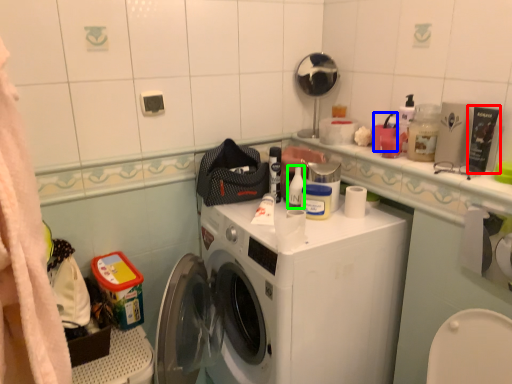
Question: Which is nearer to the toiletry (highlighted by a red box)? toiletry (highlighted by a blue box) or toiletry (highlighted by a green box).

Choices:
 (A) toiletry
 (B) toiletry

Answer: (A)